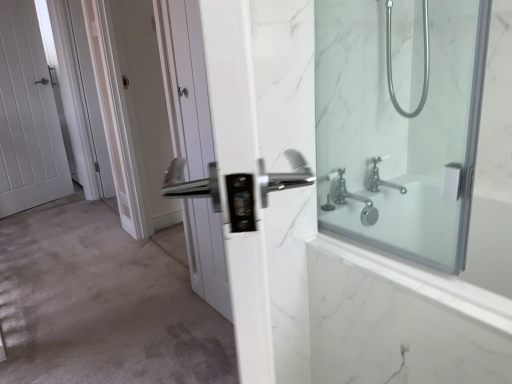
Question: Choose the correct answer: Is white matte door at center inside clear glass shower at right or outside it?

Choices:
 (A) inside
 (B) outside

Answer: (B)

Question: From the image's perspective, is white matte door at center positioned above or below clear glass shower at right?

Choices:
 (A) above
 (B) below

Answer: (B)

Question: Which object is positioned closest to the clear glass shower at right?

Choices:
 (A) chrome metallic faucet at upper right
 (B) silver metallic shower arm at upper right
 (C) white marble bathtub at right
 (D) satin nickel handle at center, acting as the 1th screen door starting from the right
 (E) white glossy door handle at center, the second door when ordered from back to front

Answer: (B)

Question: Which object is the farthest from the clear glass shower at right?

Choices:
 (A) white glossy door handle at center, the 1th door when ordered from front to back
 (B) white marble bathtub at right
 (C) silver metallic shower arm at upper right
 (D) white glossy door at upper left, which is the second screen door from front to back
 (E) chrome metallic faucet at upper right

Answer: (D)